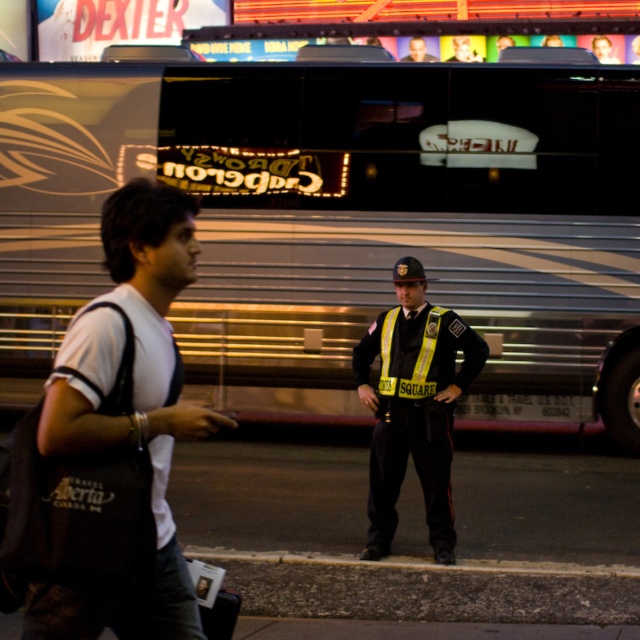
Does white t-shirt at center have a lesser width compared to smooth skin face at center?

Incorrect, white t-shirt at center's width is not less than smooth skin face at center's.

Can you confirm if white t-shirt at center is positioned below smooth skin face at center?

Actually, white t-shirt at center is above smooth skin face at center.

Where is `white t-shirt at center`? The width and height of the screenshot is (640, 640). white t-shirt at center is located at coordinates tap(461, 48).

Between smooth black uniform at center and smooth skin face at center, which one is positioned lower?

Positioned lower is smooth skin face at center.

Locate an element on the screen. The width and height of the screenshot is (640, 640). smooth black uniform at center is located at coordinates (417, 51).

Between dark gray backpack at left and white t-shirt at center, which one is positioned lower?

Positioned lower is dark gray backpack at left.

Between dark gray backpack at left and white t-shirt at center, which one appears on the left side from the viewer's perspective?

dark gray backpack at left

Locate an element on the screen. The height and width of the screenshot is (640, 640). dark gray backpack at left is located at coordinates (132, 417).

This screenshot has width=640, height=640. What are the coordinates of `dark gray backpack at left` in the screenshot? It's located at (132, 417).